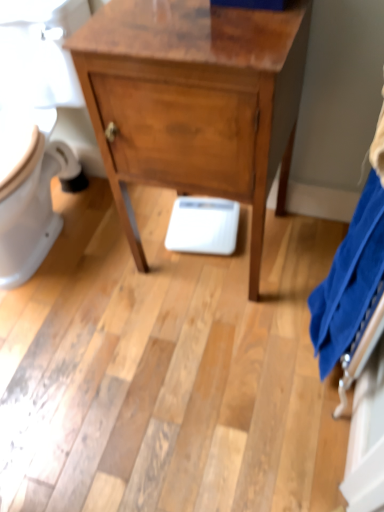
Where is `free spot above wooden chest of drawers at center (from a real-world perspective)`? free spot above wooden chest of drawers at center (from a real-world perspective) is located at coordinates (198, 19).